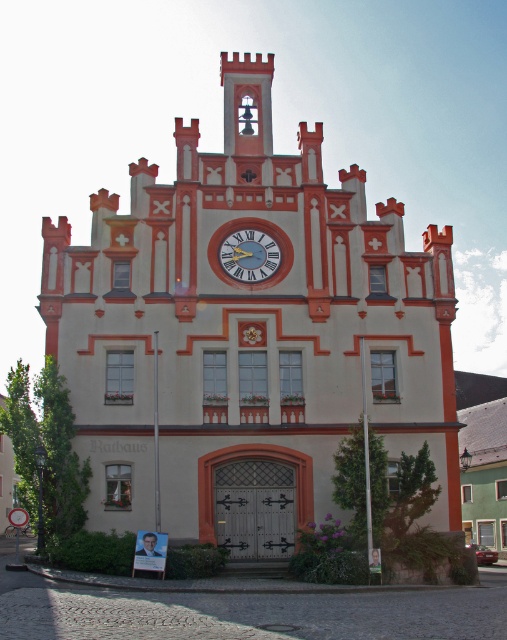
You are standing in front of the Rathaus building and notice two landmarks. The first is the white painted stone church at center, and the second is the metallic clock face at center. Which of these landmarks is located to the right of the other?

The white painted stone church at center is positioned on the right side of the metallic clock face at center.

You are standing in front of the Rathaus building and want to take a photo of both the white painted stone church at center and the metallic clock face at center. Since you have a wide angle lens, will you be able to capture both objects in the same frame without moving your camera?

The white painted stone church at center is in front of the metallic clock face at center, so the church will block the view of the clock face. Therefore, you won not be able to capture both in the same frame without moving the camera.